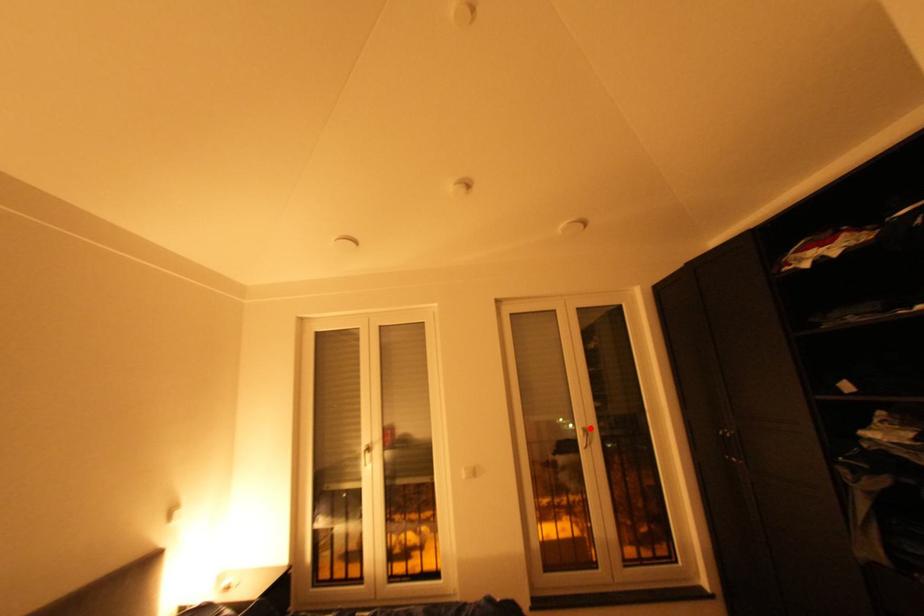
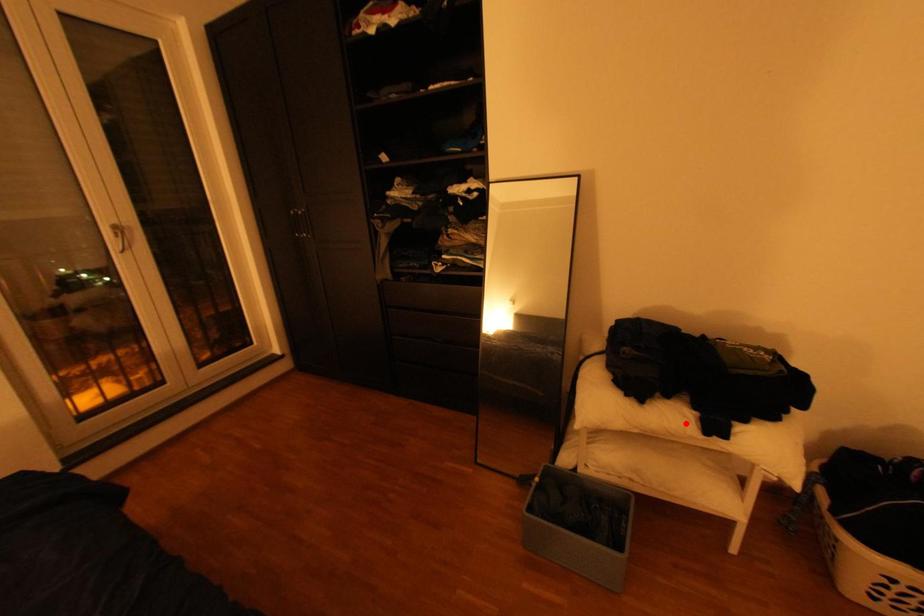
I am providing you with two images of the same scene from different viewpoints. A red point is marked on the first image and another point is marked on the second image. Is the marked point in image1 the same physical position as the marked point in image2?

No